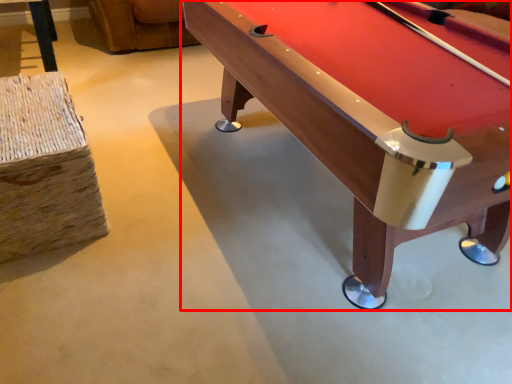
Question: In this image, where is billiard table (annotated by the red box) located relative to bar stool?

Choices:
 (A) left
 (B) right

Answer: (B)